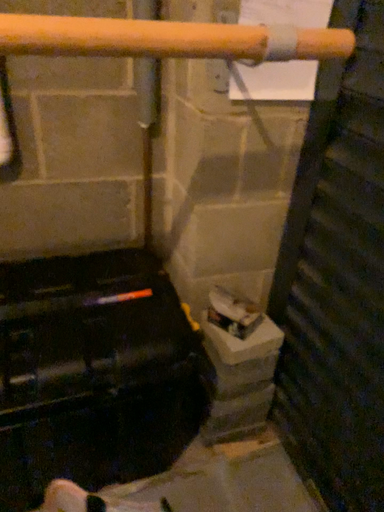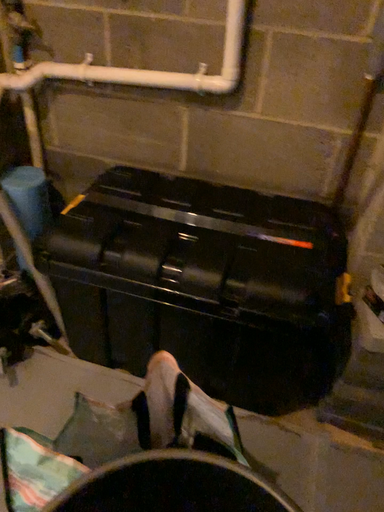
Question: How did the camera likely rotate when shooting the video?

Choices:
 (A) rotated left
 (B) rotated right

Answer: (A)